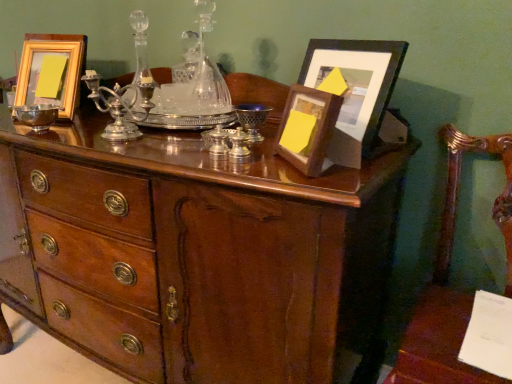
Where is `vacant point to the right of silver metallic candle holder at center, the second candle holder positioned from the front`? The image size is (512, 384). vacant point to the right of silver metallic candle holder at center, the second candle holder positioned from the front is located at coordinates (286, 166).